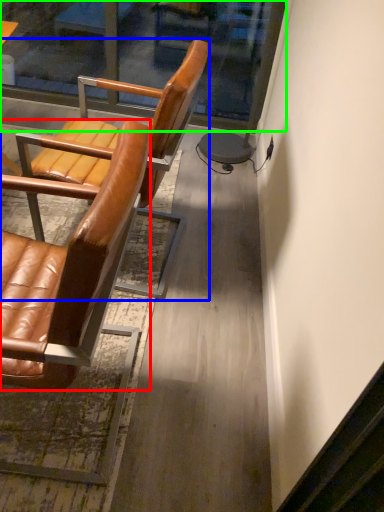
Question: Estimate the real-world distances between objects in this image. Which object is closer to chair (highlighted by a red box), chair (highlighted by a blue box) or glass door (highlighted by a green box)?

Choices:
 (A) chair
 (B) glass door

Answer: (A)